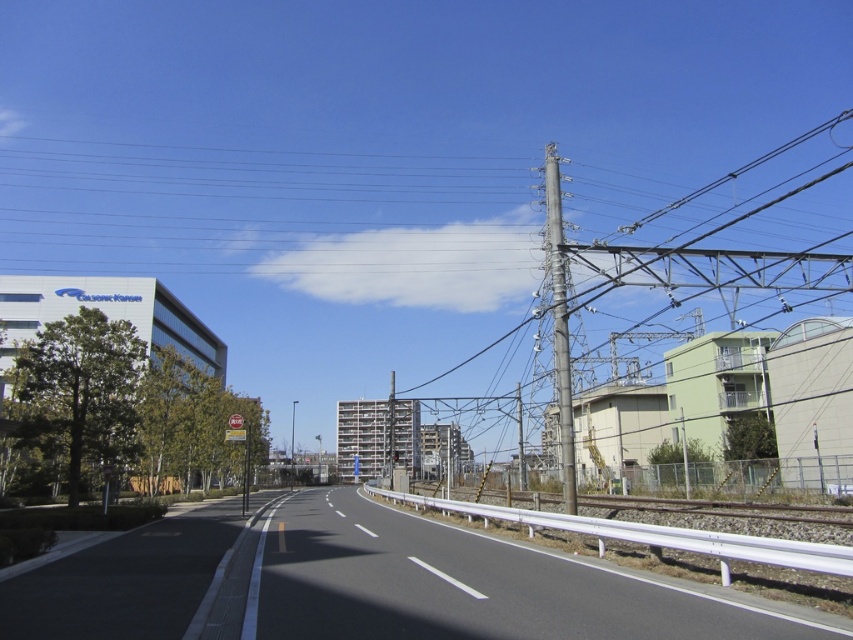
Question: Which point appears closest to the camera in this image?

Choices:
 (A) (544, 620)
 (B) (563, 330)

Answer: (A)

Question: Which object is closer to the camera taking this photo?

Choices:
 (A) black asphalt highway at center
 (B) metallic gray pole at right

Answer: (A)

Question: Considering the relative positions of black asphalt highway at center and metallic gray pole at right in the image provided, where is black asphalt highway at center located with respect to metallic gray pole at right?

Choices:
 (A) right
 (B) left

Answer: (B)

Question: Can you confirm if black asphalt highway at center is thinner than metallic gray pole at right?

Choices:
 (A) no
 (B) yes

Answer: (A)

Question: Is black asphalt highway at center to the left of metallic gray pole at right from the viewer's perspective?

Choices:
 (A) no
 (B) yes

Answer: (B)

Question: Among these objects, which one is farthest from the camera?

Choices:
 (A) black asphalt highway at center
 (B) metallic gray pole at right

Answer: (B)